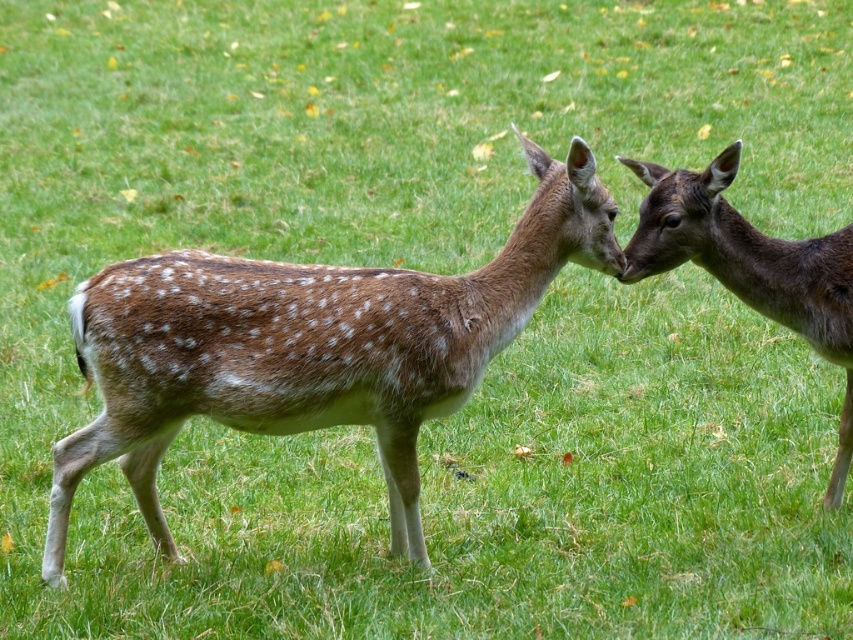
You are a wildlife photographer trying to capture a closeup shot of the brown speckled fur at center and the brown speckled fur at right. Based on their positions, which deer should you focus on first to ensure you capture both in the frame?

The brown speckled fur at center is positioned under the brown speckled fur at right, so you should focus on the brown speckled fur at right first to ensure both are in frame.

In the scene shown: You are a wildlife photographer observing two deer in a field. You notice the brown speckled fur at center and the brown speckled fur at right. Which deer has its position more to the left side of the image?

The brown speckled fur at center is positioned to the left of the brown speckled fur at right, so the deer with brown speckled fur at center is more to the left side of the image.